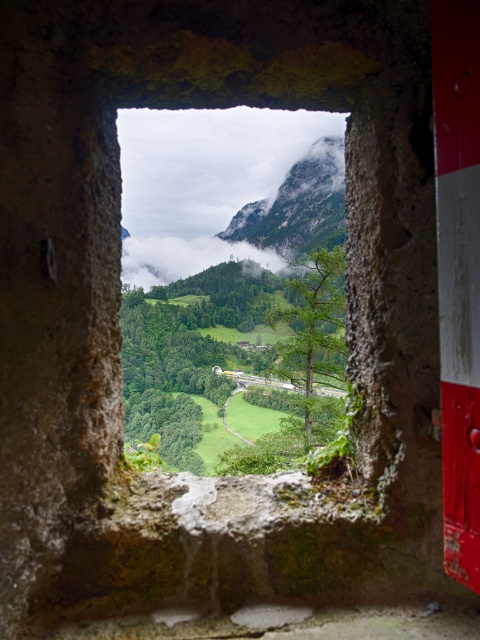
From the picture: You are an architect designing a new observation deck. You want to place a bench so that visitors can see both the transparent glass window at center and the green grassy mountain at center. Where should you place the bench relative to the window and mountain?

The transparent glass window at center is to the left of the green grassy mountain at center, so placing the bench between them or to the right side of the window and left side of the mountain would allow visitors to see both objects.